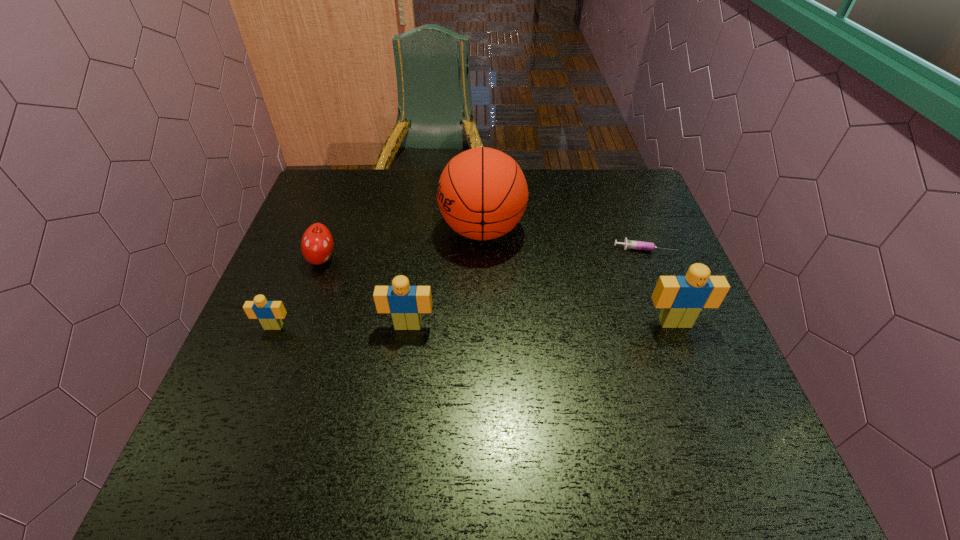
This screenshot has width=960, height=540. Identify the location of vacant area that lies between the second shortest Lego and the rightmost Lego. (541, 324).

Locate an element on the screen. This screenshot has width=960, height=540. free space between the shortest Lego and the rightmost Lego is located at coordinates [x=474, y=325].

I want to click on unoccupied area between the third tallest object and the shortest object, so click(526, 287).

This screenshot has height=540, width=960. In order to click on free space between the rightmost Lego and the apple in this screenshot , I will do `click(498, 291)`.

At what (x,y) coordinates should I click in order to perform the action: click on free spot between the shortest Lego and the rightmost Lego. Please return your answer as a coordinate pair (x, y). The height and width of the screenshot is (540, 960). Looking at the image, I should click on (474, 325).

I want to click on vacant space in between the shortest object and the leftmost Lego, so click(459, 287).

Find the location of `object that ranks as the third closest to the shortest Lego`. object that ranks as the third closest to the shortest Lego is located at coordinates (482, 193).

Locate which object ranks fifth in proximity to the third tallest object. Please provide its 2D coordinates. Your answer should be formatted as a tuple, i.e. [(x, y)], where the tuple contains the x and y coordinates of a point satisfying the conditions above.

[(628, 244)]

At what (x,y) coordinates should I click in order to perform the action: click on Lego that stands as the second closest to the rightmost Lego. Please return your answer as a coordinate pair (x, y). Looking at the image, I should click on (269, 313).

Identify which Lego is the closest to the basketball. Please provide its 2D coordinates. Your answer should be formatted as a tuple, i.e. [(x, y)], where the tuple contains the x and y coordinates of a point satisfying the conditions above.

[(405, 303)]